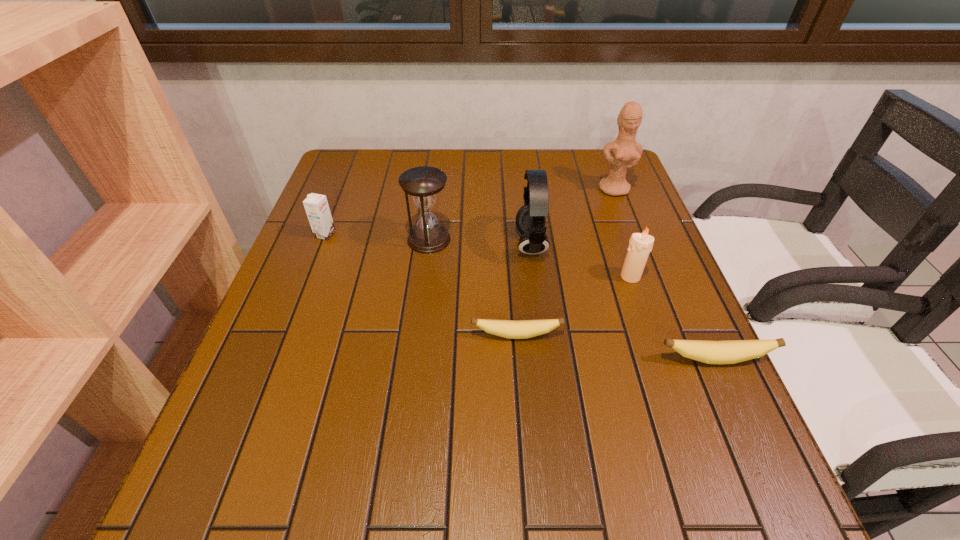
Image resolution: width=960 pixels, height=540 pixels. What are the coordinates of `vacant space located on the left of the candle` in the screenshot? It's located at (516, 276).

Locate an element on the screen. This screenshot has width=960, height=540. object at the far edge is located at coordinates (626, 151).

The width and height of the screenshot is (960, 540). Identify the location of object that is at the left edge. (316, 205).

Identify the location of banana that is at the right edge. Image resolution: width=960 pixels, height=540 pixels. (732, 351).

Identify the location of figurine located at the right edge. (626, 151).

This screenshot has width=960, height=540. Identify the location of candle at the right edge. (640, 244).

The image size is (960, 540). I want to click on object that is at the far right corner, so click(626, 151).

The height and width of the screenshot is (540, 960). In the image, there is a desktop. In order to click on vacant space at the far edge in this screenshot , I will do `click(410, 154)`.

Find the location of a particular element. free space at the near edge is located at coordinates (572, 424).

Where is `vacant position at the left edge of the desktop`? Image resolution: width=960 pixels, height=540 pixels. vacant position at the left edge of the desktop is located at coordinates (366, 193).